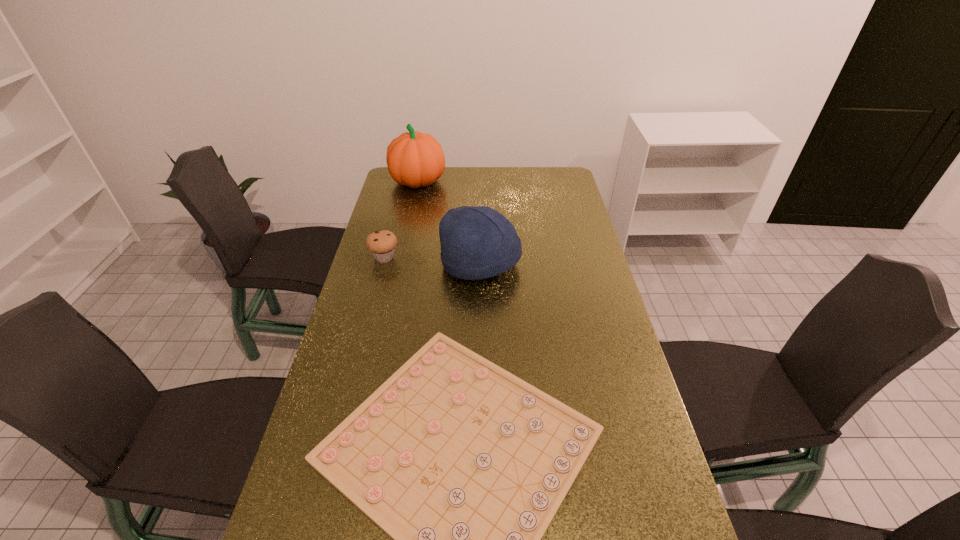
Find the location of a particular element. object that is at the far left corner is located at coordinates (414, 159).

This screenshot has height=540, width=960. I want to click on free space at the far edge of the desktop, so click(465, 181).

In the image, there is a desktop. Where is `vacant space at the left edge`? vacant space at the left edge is located at coordinates (406, 203).

Find the location of a particular element. Image resolution: width=960 pixels, height=540 pixels. vacant space at the right edge is located at coordinates (565, 253).

Locate an element on the screen. This screenshot has height=540, width=960. vacant space at the far left corner of the desktop is located at coordinates (409, 192).

Where is `free space between the third tallest object and the skullcap`? The height and width of the screenshot is (540, 960). free space between the third tallest object and the skullcap is located at coordinates (433, 261).

At what (x,y) coordinates should I click in order to perform the action: click on vacant area that lies between the skullcap and the muffin. Please return your answer as a coordinate pair (x, y). Looking at the image, I should click on (433, 261).

Where is `vacant area that lies between the second tallest object and the third tallest object`? The height and width of the screenshot is (540, 960). vacant area that lies between the second tallest object and the third tallest object is located at coordinates (433, 261).

Select which object appears as the closest to the muffin. Please provide its 2D coordinates. Your answer should be formatted as a tuple, i.e. [(x, y)], where the tuple contains the x and y coordinates of a point satisfying the conditions above.

[(479, 242)]

Image resolution: width=960 pixels, height=540 pixels. I want to click on the third closest object to the muffin, so click(414, 159).